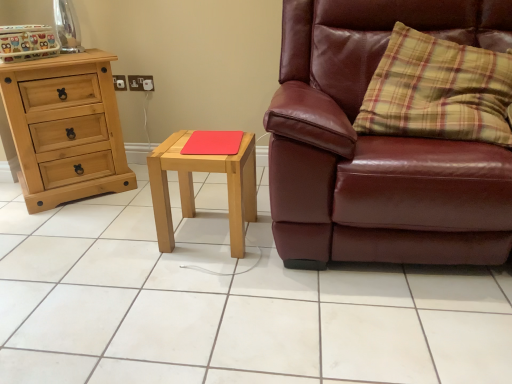
Identify the location of free space in front of natural wood chest of drawers at left. The height and width of the screenshot is (384, 512). (61, 224).